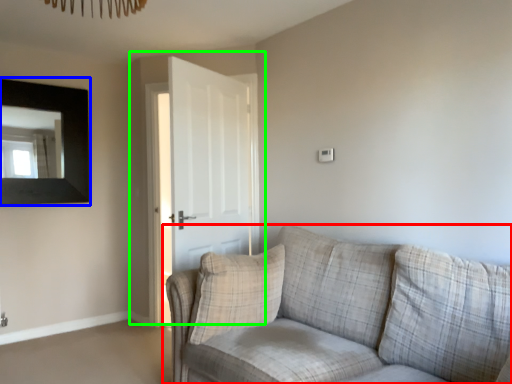
Question: Considering the real-world distances, which object is farthest from studio couch (highlighted by a red box)? picture frame (highlighted by a blue box) or door (highlighted by a green box)?

Choices:
 (A) picture frame
 (B) door

Answer: (A)